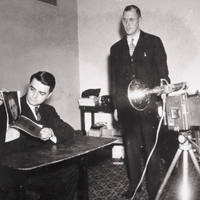
At what (x,y) coordinates should I click in order to perform the action: click on carpet. Please return your answer as a coordinate pair (x, y). The height and width of the screenshot is (200, 200). Looking at the image, I should click on (103, 183).